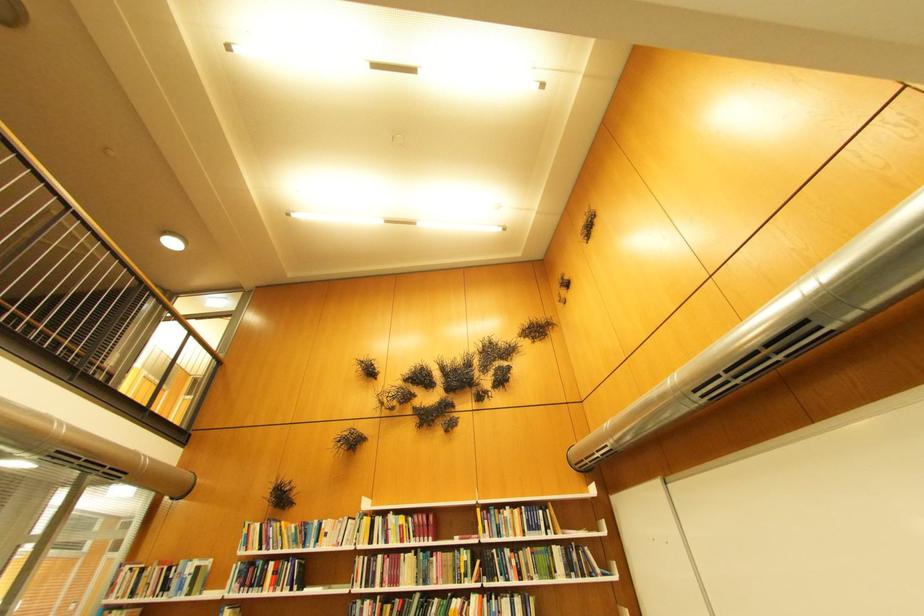
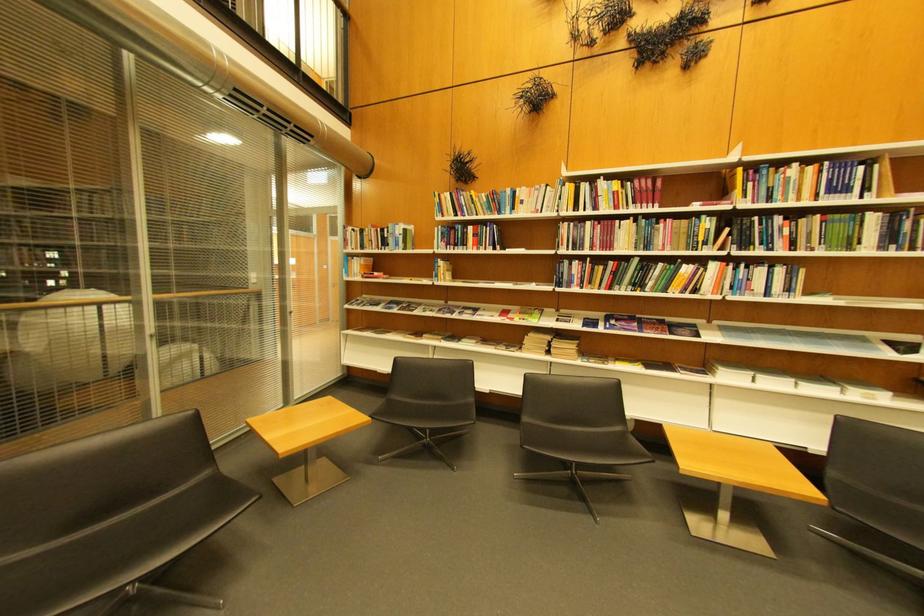
Where in the second image is the point corresponding to the point at 323,541 from the first image?

(518, 209)